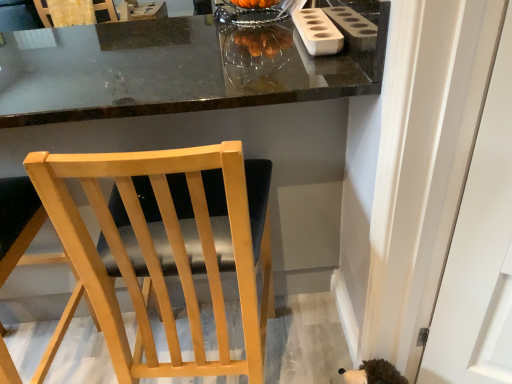
Locate an element on the screen. white matte holder at upper right is located at coordinates (317, 32).

The height and width of the screenshot is (384, 512). Describe the element at coordinates (106, 9) in the screenshot. I see `wooden chair at upper left, which appears as the first chair when viewed from the top` at that location.

The width and height of the screenshot is (512, 384). What do you see at coordinates (31, 255) in the screenshot?
I see `light wood chair at center, which is counted as the 2th chair, starting from the left` at bounding box center [31, 255].

The height and width of the screenshot is (384, 512). Describe the element at coordinates (205, 115) in the screenshot. I see `matte black table at center` at that location.

Find the location of a particular element. white matte holder at upper right is located at coordinates (317, 32).

From a real-world perspective, does light wood chair at center, the second chair in the back-to-front sequence, sit lower than light wood chair at center, positioned as the 2th chair in top-to-bottom order?

Yes, from a real-world perspective, light wood chair at center, the second chair in the back-to-front sequence, is beneath light wood chair at center, positioned as the 2th chair in top-to-bottom order.

Does light wood chair at center, the second chair in the back-to-front sequence, have a lesser height compared to light wood chair at center, acting as the third chair starting from the back?

Yes.

Based on the photo, what's the angular difference between light wood chair at center, the second chair in the back-to-front sequence, and light wood chair at center, the 2th chair positioned from the bottom,'s facing directions?

They differ by 2.63 degrees in their facing directions.

From the image's perspective, who appears lower, light wood chair at center, which appears as the first chair when ordered from the bottom, or light wood chair at center, the 2th chair positioned from the bottom?

light wood chair at center, which appears as the first chair when ordered from the bottom, from the image's perspective.

Between wooden chair at upper left, marked as the 3th chair in a front-to-back arrangement, and light wood chair at center, acting as the 1th chair starting from the right, which one has larger size?

light wood chair at center, acting as the 1th chair starting from the right.

Locate an element on the screen. Image resolution: width=512 pixels, height=384 pixels. chair above the light wood chair at center, acting as the third chair starting from the left (from the image's perspective) is located at coordinates (106, 9).

Is wooden chair at upper left, which appears as the 3th chair when viewed from the right, positioned beyond the bounds of light wood chair at center, acting as the third chair starting from the left?

Yes, wooden chair at upper left, which appears as the 3th chair when viewed from the right, is located beyond the bounds of light wood chair at center, acting as the third chair starting from the left.

From the picture: In the image, is white matte holder at upper right positioned in front of or behind wooden chair at upper left, the first chair positioned from the back?

white matte holder at upper right is positioned closer to the viewer than wooden chair at upper left, the first chair positioned from the back.

Could you tell me if white matte holder at upper right is turned towards wooden chair at upper left, which is the third chair from bottom to top?

No, white matte holder at upper right is not facing towards wooden chair at upper left, which is the third chair from bottom to top.

Which is correct: white matte holder at upper right is inside wooden chair at upper left, which appears as the first chair when viewed from the top, or outside of it?

white matte holder at upper right lies outside wooden chair at upper left, which appears as the first chair when viewed from the top.

How far apart are white matte holder at upper right and wooden chair at upper left, which appears as the first chair when viewed from the top?

A distance of 6.93 feet exists between white matte holder at upper right and wooden chair at upper left, which appears as the first chair when viewed from the top.

In the scene shown: How different are the orientations of light wood chair at center, marked as the second chair in a right-to-left arrangement, and wooden chair at upper left, which appears as the 3th chair when viewed from the right, in degrees?

9.27 degrees.

Considering the sizes of objects light wood chair at center, which appears as the first chair when ordered from the bottom, and wooden chair at upper left, marked as the 3th chair in a front-to-back arrangement, in the image provided, who is taller, light wood chair at center, which appears as the first chair when ordered from the bottom, or wooden chair at upper left, marked as the 3th chair in a front-to-back arrangement,?

light wood chair at center, which appears as the first chair when ordered from the bottom.

Is light wood chair at center, which appears as the first chair when ordered from the bottom, facing away from wooden chair at upper left, the 1th chair viewed from the left?

No, light wood chair at center, which appears as the first chair when ordered from the bottom,'s orientation is not away from wooden chair at upper left, the 1th chair viewed from the left.

Is light wood chair at center, which appears as the first chair when ordered from the bottom, located outside wooden chair at upper left, which appears as the 3th chair when viewed from the right?

Yes, light wood chair at center, which appears as the first chair when ordered from the bottom, is outside of wooden chair at upper left, which appears as the 3th chair when viewed from the right.

Is light wood chair at center, which is counted as the 2th chair, starting from the left, thinner than matte black table at center?

Correct, the width of light wood chair at center, which is counted as the 2th chair, starting from the left, is less than that of matte black table at center.

From a real-world perspective, is light wood chair at center, the second chair in the back-to-front sequence, physically located above or below matte black table at center?

light wood chair at center, the second chair in the back-to-front sequence, is below matte black table at center.

Is light wood chair at center, marked as the second chair in a right-to-left arrangement, oriented away from matte black table at center?

Yes.

Can you confirm if light wood chair at center, marked as the third chair in a top-to-bottom arrangement, is smaller than matte black table at center?

Indeed, light wood chair at center, marked as the third chair in a top-to-bottom arrangement, has a smaller size compared to matte black table at center.

Is point (307, 10) farther from viewer compared to point (304, 105)?

Yes, it is behind point (304, 105).

In the image, is white matte holder at upper right positioned in front of or behind matte black table at center?

white matte holder at upper right is behind matte black table at center.

Where is `table below the white matte holder at upper right (from the image's perspective)`? table below the white matte holder at upper right (from the image's perspective) is located at coordinates (205, 115).

Can you tell me how much wooden chair at upper left, which is the third chair from bottom to top, and matte black table at center differ in facing direction?

The facing directions of wooden chair at upper left, which is the third chair from bottom to top, and matte black table at center are 6.38 degrees apart.

From the picture: Is wooden chair at upper left, which appears as the 3th chair when viewed from the right, looking in the opposite direction of matte black table at center?

Yes, wooden chair at upper left, which appears as the 3th chair when viewed from the right, is facing away from matte black table at center.

Is the depth of wooden chair at upper left, the first chair positioned from the back, greater than that of matte black table at center?

Yes, it is behind matte black table at center.

Consider the image. From a real-world perspective, which object rests below the other?

From a 3D spatial view, matte black table at center is below.

At what (x,y) coordinates should I click in order to perform the action: click on the 1st chair positioned above the light wood chair at center, marked as the second chair in a front-to-back arrangement (from a real-world perspective). Please return your answer as a coordinate pair (x, y). The image size is (512, 384). Looking at the image, I should click on (167, 245).

Where is `the 1st chair below the wooden chair at upper left, which appears as the first chair when viewed from the top (from the image's perspective)`? the 1st chair below the wooden chair at upper left, which appears as the first chair when viewed from the top (from the image's perspective) is located at coordinates (167, 245).

From the image, which object appears to be nearer to light wood chair at center, acting as the third chair starting from the left, light wood chair at center, the second chair in the back-to-front sequence, or white matte holder at upper right?

Based on the image, light wood chair at center, the second chair in the back-to-front sequence, appears to be nearer to light wood chair at center, acting as the third chair starting from the left.

Which object lies further to the anchor point light wood chair at center, marked as the second chair in a right-to-left arrangement, matte black table at center or wooden chair at upper left, which appears as the 3th chair when viewed from the right?

Among the two, wooden chair at upper left, which appears as the 3th chair when viewed from the right, is located further to light wood chair at center, marked as the second chair in a right-to-left arrangement.

Based on their spatial positions, is light wood chair at center, acting as the third chair starting from the back, or matte black table at center closer to wooden chair at upper left, the first chair positioned from the back?

Among the two, matte black table at center is located nearer to wooden chair at upper left, the first chair positioned from the back.

Looking at the image, which one is located closer to white matte holder at upper right, light wood chair at center, acting as the third chair starting from the left, or light wood chair at center, marked as the second chair in a right-to-left arrangement?

light wood chair at center, acting as the third chair starting from the left, lies closer to white matte holder at upper right than the other object.

From the image, which object appears to be farther from white matte holder at upper right, wooden chair at upper left, marked as the 3th chair in a front-to-back arrangement, or light wood chair at center, which appears as the first chair when ordered from the bottom?

wooden chair at upper left, marked as the 3th chair in a front-to-back arrangement.

Looking at the image, which one is located further to light wood chair at center, which is counted as the 2th chair, starting from the left, light wood chair at center, the 2th chair positioned from the bottom, or wooden chair at upper left, which appears as the first chair when viewed from the top?

wooden chair at upper left, which appears as the first chair when viewed from the top, is positioned further to the anchor light wood chair at center, which is counted as the 2th chair, starting from the left.

From the image, which object appears to be farther from matte black table at center, light wood chair at center, the 2th chair positioned from the bottom, or wooden chair at upper left, the 1th chair viewed from the left?

wooden chair at upper left, the 1th chair viewed from the left.

From the picture: From the image, which object appears to be farther from wooden chair at upper left, the 1th chair viewed from the left, light wood chair at center, the second chair in the back-to-front sequence, or matte black table at center?

Based on the image, light wood chair at center, the second chair in the back-to-front sequence, appears to be further to wooden chair at upper left, the 1th chair viewed from the left.

Locate an element on the screen. appliance between light wood chair at center, acting as the 1th chair starting from the right, and wooden chair at upper left, which appears as the 3th chair when viewed from the right, along the z-axis is located at coordinates (317, 32).

I want to click on table between light wood chair at center, which is counted as the 2th chair, starting from the left, and white matte holder at upper right, so click(x=205, y=115).

At what (x,y) coordinates should I click in order to perform the action: click on table between white matte holder at upper right and light wood chair at center, marked as the 1th chair in a front-to-back arrangement, vertically. Please return your answer as a coordinate pair (x, y). The image size is (512, 384). Looking at the image, I should click on (205, 115).

Locate an element on the screen. The width and height of the screenshot is (512, 384). table located between light wood chair at center, the second chair in the back-to-front sequence, and light wood chair at center, acting as the third chair starting from the back, in the left-right direction is located at coordinates (205, 115).